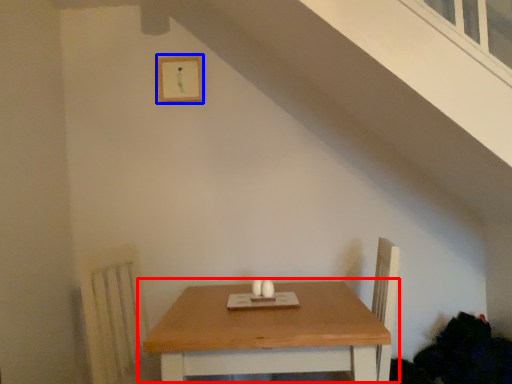
Question: Which point is further to the camera, table (highlighted by a red box) or picture frame (highlighted by a blue box)?

Choices:
 (A) table
 (B) picture frame

Answer: (B)